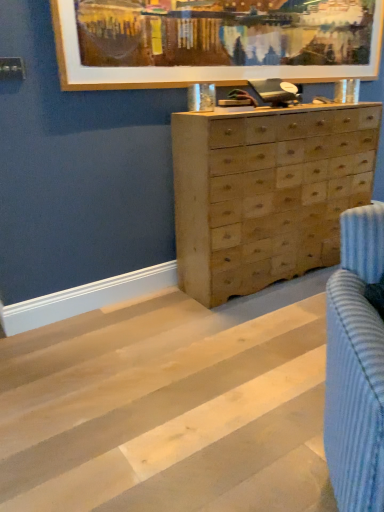
Where is `unoccupied area in front of natural wood chest of drawers at center`? unoccupied area in front of natural wood chest of drawers at center is located at coordinates (253, 340).